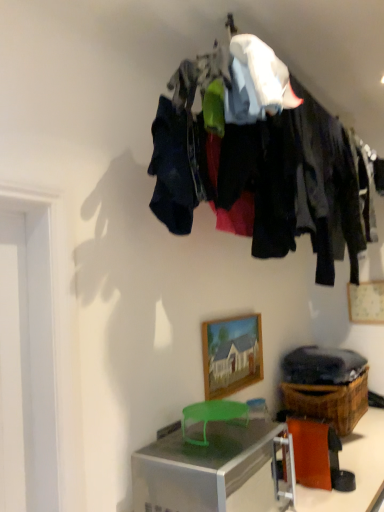
Question: Is orange paper at lower right turned away from wooden picture frame at center, which is the first picture frame from front to back?

Choices:
 (A) yes
 (B) no

Answer: (B)

Question: Is there a large distance between orange paper at lower right and wooden picture frame at center, marked as the second picture frame in a right-to-left arrangement?

Choices:
 (A) yes
 (B) no

Answer: (B)

Question: Is wooden picture frame at center, marked as the second picture frame in a right-to-left arrangement, a part of orange paper at lower right?

Choices:
 (A) yes
 (B) no

Answer: (B)

Question: Is orange paper at lower right bigger than wooden picture frame at center, which is the first picture frame from front to back?

Choices:
 (A) no
 (B) yes

Answer: (B)

Question: Is orange paper at lower right positioned in front of wooden picture frame at center, the 2th picture frame when ordered from back to front?

Choices:
 (A) no
 (B) yes

Answer: (B)

Question: From their relative heights in the image, would you say orange paper at lower right is taller or shorter than dark fabric clothes at upper center?

Choices:
 (A) tall
 (B) short

Answer: (B)

Question: Is orange paper at lower right spatially inside dark fabric clothes at upper center, or outside of it?

Choices:
 (A) outside
 (B) inside

Answer: (A)

Question: Would you say orange paper at lower right is to the left or to the right of dark fabric clothes at upper center in the picture?

Choices:
 (A) right
 (B) left

Answer: (A)

Question: Considering the positions of orange paper at lower right and dark fabric clothes at upper center in the image, is orange paper at lower right wider or thinner than dark fabric clothes at upper center?

Choices:
 (A) thin
 (B) wide

Answer: (A)

Question: Considering the positions of silver metallic desk at lower center and wooden picture frame at upper right, the second picture frame viewed from the front, in the image, is silver metallic desk at lower center taller or shorter than wooden picture frame at upper right, the second picture frame viewed from the front,?

Choices:
 (A) short
 (B) tall

Answer: (B)

Question: Choose the correct answer: Is silver metallic desk at lower center inside wooden picture frame at upper right, the second picture frame viewed from the front, or outside it?

Choices:
 (A) outside
 (B) inside

Answer: (A)

Question: Considering their positions, is silver metallic desk at lower center located in front of or behind wooden picture frame at upper right, the second picture frame viewed from the front?

Choices:
 (A) behind
 (B) front

Answer: (B)

Question: Considering the positions of point (369, 408) and point (367, 318), is point (369, 408) closer or farther from the camera than point (367, 318)?

Choices:
 (A) closer
 (B) farther

Answer: (A)

Question: Looking at their shapes, would you say wooden picture frame at upper right, the second picture frame viewed from the front, is wider or thinner than brown woven basket at lower right?

Choices:
 (A) thin
 (B) wide

Answer: (A)

Question: Is point (369, 294) positioned closer to the camera than point (342, 421)?

Choices:
 (A) closer
 (B) farther

Answer: (B)